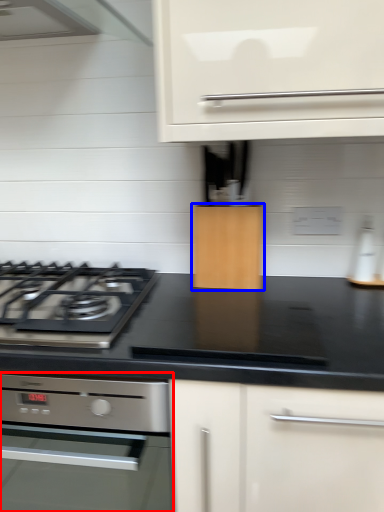
Question: Which of the following is the farthest to the observer, home appliance (highlighted by a red box) or cabinetry (highlighted by a blue box)?

Choices:
 (A) home appliance
 (B) cabinetry

Answer: (B)